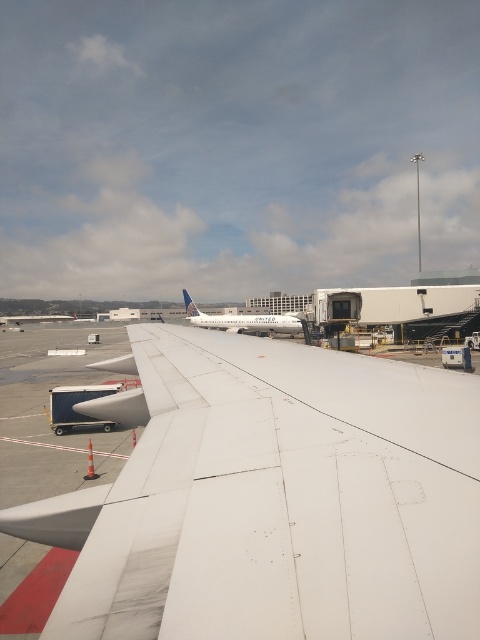
Consider the image. Is white matte airplane at center further to the viewer compared to white matte airplane tail at center?

No.

Which is behind, point (230, 321) or point (192, 307)?

Point (192, 307)

Locate an element on the screen. white matte airplane at center is located at coordinates (242, 321).

Does white matte wing at center appear over white matte airplane tail at center?

No.

In the scene shown: Does white matte wing at center appear on the right side of white matte airplane tail at center?

Yes, white matte wing at center is to the right of white matte airplane tail at center.

Is point (109, 497) behind point (188, 298)?

No, (109, 497) is closer to viewer.

Where is `white matte wing at center`? The width and height of the screenshot is (480, 640). white matte wing at center is located at coordinates (273, 499).

The height and width of the screenshot is (640, 480). Identify the location of white matte wing at center. (273, 499).

Is white matte wing at center taller than white matte airplane at center?

No.

Image resolution: width=480 pixels, height=640 pixels. Describe the element at coordinates (273, 499) in the screenshot. I see `white matte wing at center` at that location.

Locate an element on the screen. Image resolution: width=480 pixels, height=640 pixels. white matte wing at center is located at coordinates (273, 499).